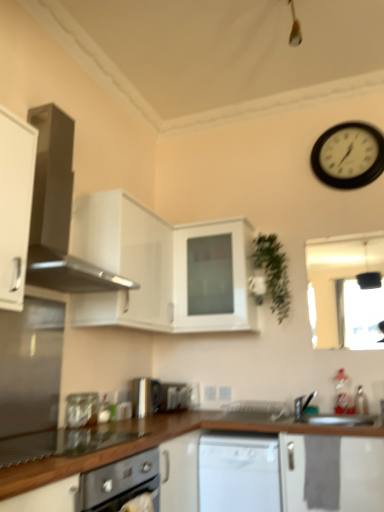
This screenshot has width=384, height=512. Find the location of `blank space situated above black plastic wall clock at upper right (from a real-world perspective)`. blank space situated above black plastic wall clock at upper right (from a real-world perspective) is located at coordinates (342, 125).